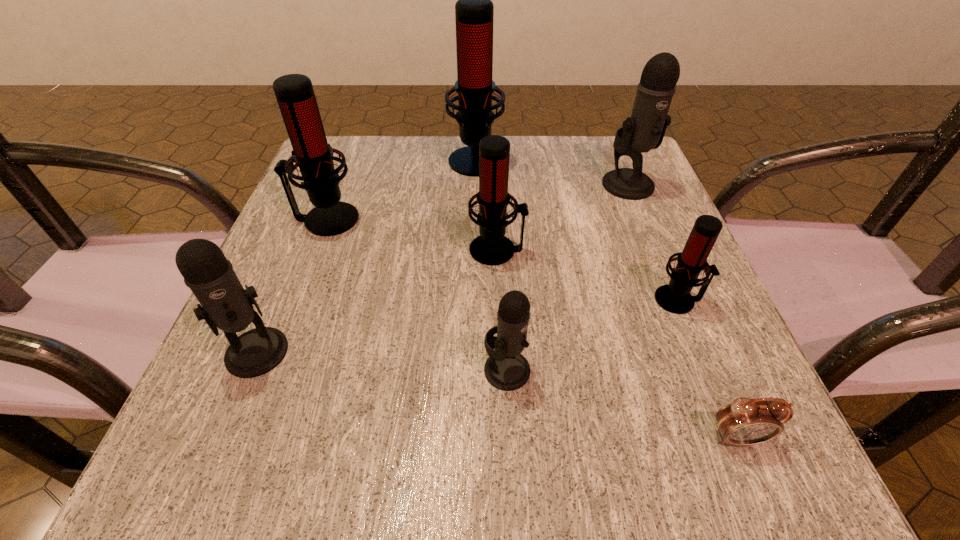
Locate an element on the screen. The width and height of the screenshot is (960, 540). alarm clock situated at the right edge is located at coordinates (745, 421).

Locate an element on the screen. The image size is (960, 540). object located in the far right corner section of the desktop is located at coordinates (645, 129).

The width and height of the screenshot is (960, 540). What are the coordinates of `object that is at the near right corner` in the screenshot? It's located at (745, 421).

What are the coordinates of `free space at the far edge` in the screenshot? It's located at (421, 160).

At what (x,y) coordinates should I click in order to perform the action: click on free space at the near edge. Please return your answer as a coordinate pair (x, y). This screenshot has width=960, height=540. Looking at the image, I should click on (379, 447).

The image size is (960, 540). In order to click on vacant area at the left edge of the desktop in this screenshot , I will do `click(292, 347)`.

Find the location of a particular element. vacant space at the right edge of the desktop is located at coordinates (710, 296).

At what (x,y) coordinates should I click in order to perform the action: click on vacant space at the far left corner of the desktop. Please return your answer as a coordinate pair (x, y). Image resolution: width=960 pixels, height=540 pixels. Looking at the image, I should click on (361, 164).

Locate an element on the screen. This screenshot has width=960, height=540. vacant region at the far right corner of the desktop is located at coordinates (593, 152).

Locate an element on the screen. The image size is (960, 540). free space between the leftmost red microphone and the second black microphone from left to right is located at coordinates (417, 295).